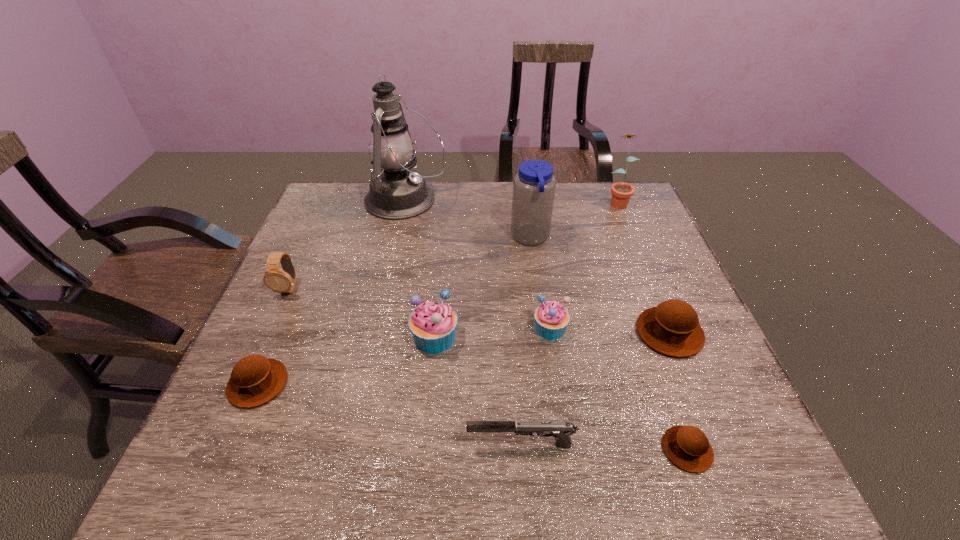
Locate which muffin is the fourth closest to the second shortest muffin. Please provide its 2D coordinates. Your answer should be formatted as a tuple, i.e. [(x, y)], where the tuple contains the x and y coordinates of a point satisfying the conditions above.

[(672, 328)]

The height and width of the screenshot is (540, 960). I want to click on muffin object that ranks as the third closest to the water bottle, so click(x=433, y=324).

Image resolution: width=960 pixels, height=540 pixels. I want to click on brown muffin that can be found as the second closest to the watch, so click(672, 328).

Select which brown muffin is the closest to the farthest brown muffin. Please provide its 2D coordinates. Your answer should be formatted as a tuple, i.e. [(x, y)], where the tuple contains the x and y coordinates of a point satisfying the conditions above.

[(687, 447)]

This screenshot has height=540, width=960. Identify the location of vacant space that satisfies the following two spatial constraints: 1. on the back side of the smaller blue muffin; 2. on the left side of the left blue muffin. (436, 328).

Where is `vacant space that satisfies the following two spatial constraints: 1. with a carrying loop on the side of the blue water bottle; 2. on the back side of the right blue muffin`? This screenshot has width=960, height=540. vacant space that satisfies the following two spatial constraints: 1. with a carrying loop on the side of the blue water bottle; 2. on the back side of the right blue muffin is located at coordinates (542, 328).

Where is `free location that satisfies the following two spatial constraints: 1. on the face of the third muffin from right to left; 2. on the left side of the watch`? free location that satisfies the following two spatial constraints: 1. on the face of the third muffin from right to left; 2. on the left side of the watch is located at coordinates (271, 328).